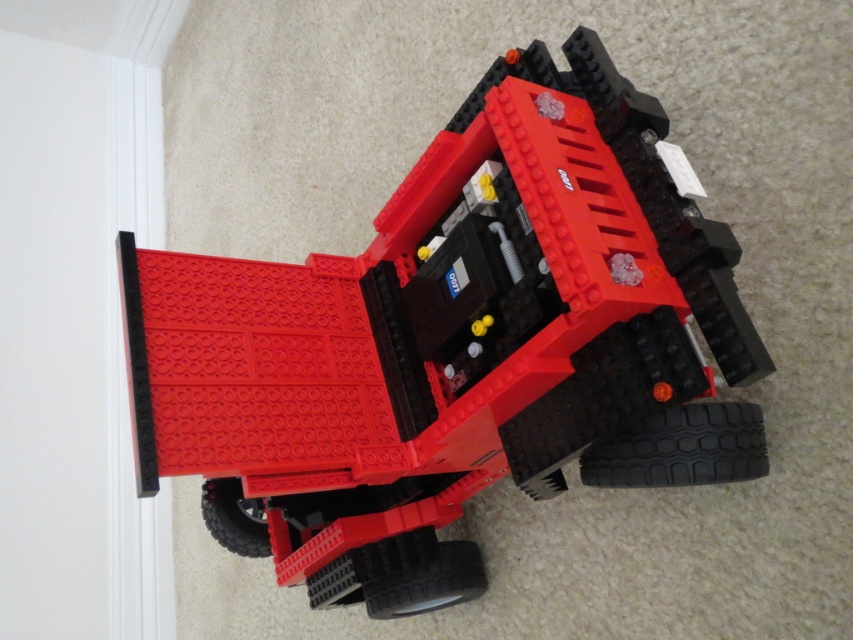
Question: Is black rubber tire at lower right positioned before black rubber tire at lower left?

Choices:
 (A) no
 (B) yes

Answer: (B)

Question: Is matte plastic toy car at center positioned at the back of black rubber tire at lower left?

Choices:
 (A) yes
 (B) no

Answer: (B)

Question: Which of the following is the closest to the observer?

Choices:
 (A) black rubber tire at lower center
 (B) matte plastic toy car at center

Answer: (B)

Question: Which of the following is the farthest from the observer?

Choices:
 (A) black rubber tire at lower left
 (B) black rubber tire at lower center

Answer: (A)

Question: Can you confirm if black rubber tire at lower right is wider than black rubber tire at lower center?

Choices:
 (A) no
 (B) yes

Answer: (A)

Question: Among these objects, which one is farthest from the camera?

Choices:
 (A) black rubber tire at lower left
 (B) black rubber tire at lower right
 (C) black rubber tire at lower center
 (D) matte plastic toy car at center

Answer: (A)